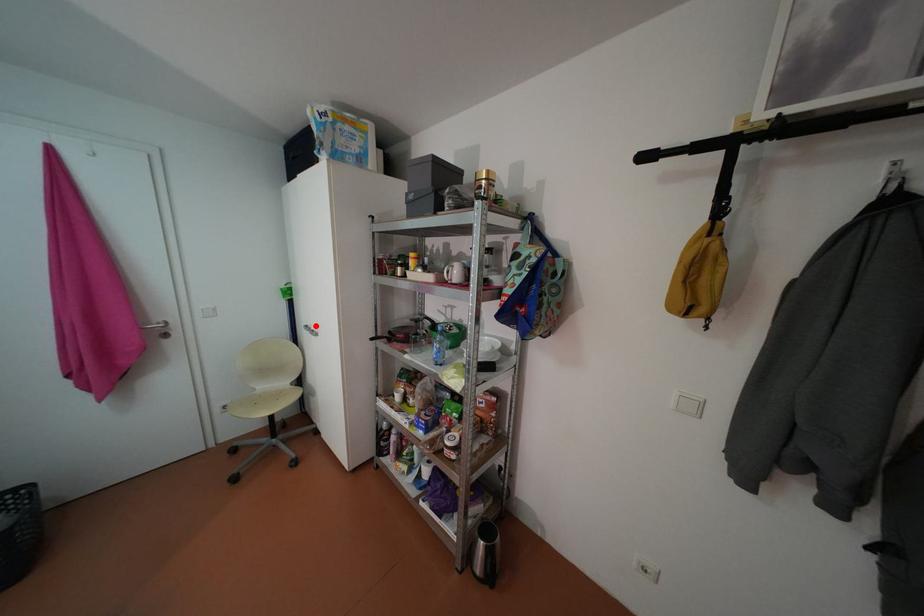
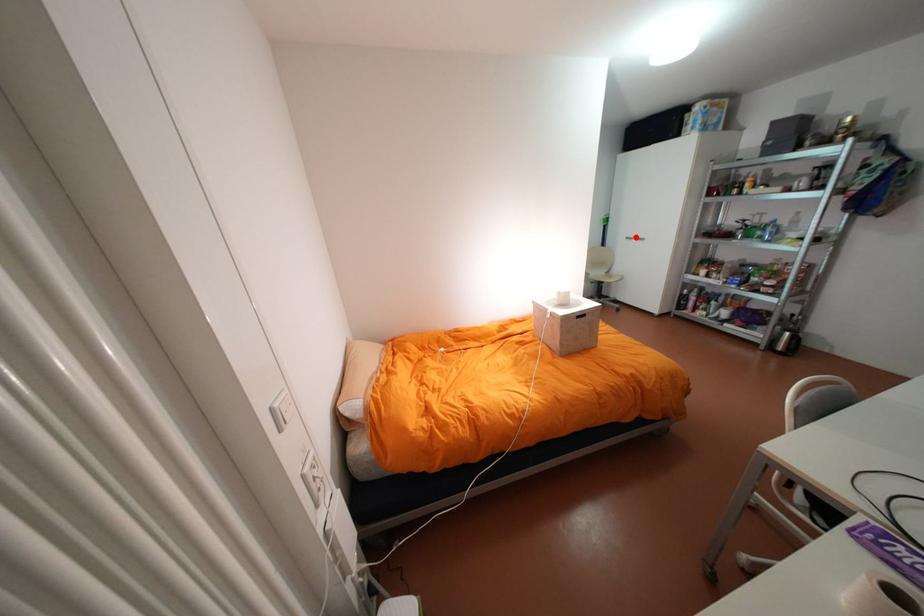
I am providing you with two images of the same scene from different viewpoints. A red point is marked on the first image and another point is marked on the second image. Are the points marked in image1 and image2 representing the same 3D position?

Yes